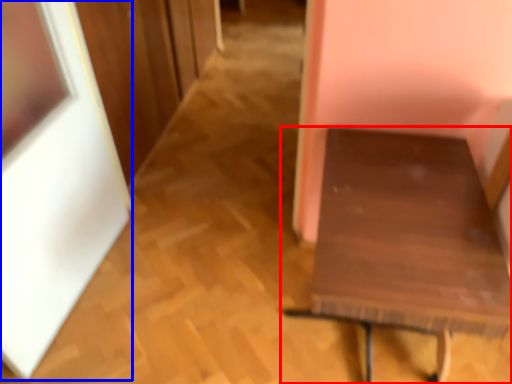
Question: Which point is closer to the camera, furniture (highlighted by a red box) or picture frame (highlighted by a blue box)?

Choices:
 (A) furniture
 (B) picture frame

Answer: (B)